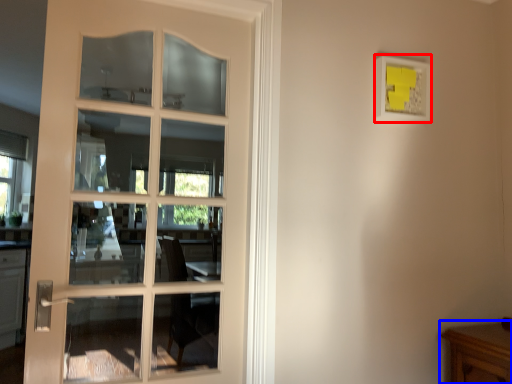
Question: Which object is closer to the camera taking this photo, picture frame (highlighted by a red box) or table (highlighted by a blue box)?

Choices:
 (A) picture frame
 (B) table

Answer: (B)